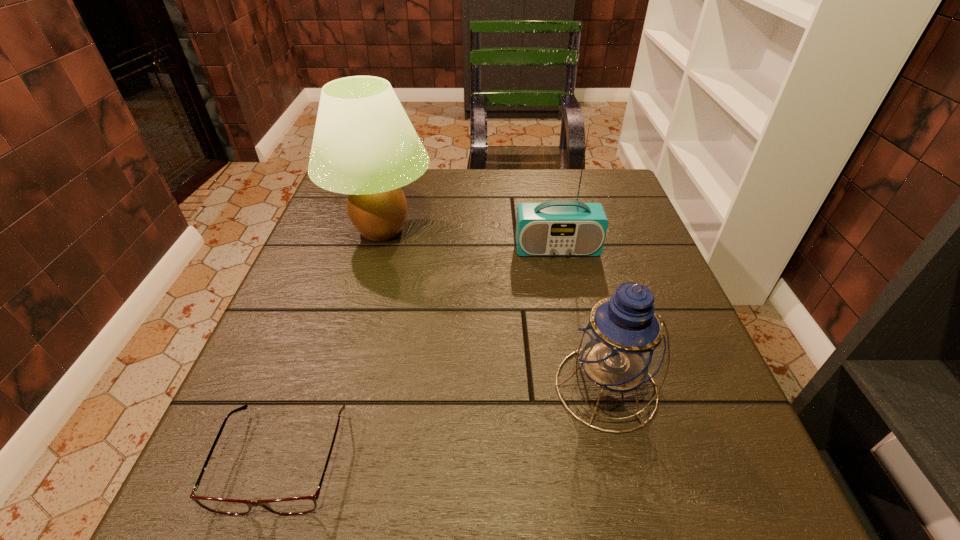
At what (x,y) coordinates should I click in order to perform the action: click on lampshade. Please return your answer as a coordinate pair (x, y). The image size is (960, 540). Looking at the image, I should click on [x=364, y=145].

Locate an element on the screen. the second tallest object is located at coordinates (559, 227).

I want to click on lantern, so click(x=620, y=344).

The width and height of the screenshot is (960, 540). In order to click on spectacles in this screenshot , I will do `click(305, 504)`.

I want to click on vacant space located on the shade of the lampshade, so click(x=548, y=230).

You are a GUI agent. You are given a task and a screenshot of the screen. Output one action in this format:
    pyautogui.click(x=<x>, y=<y>)
    Task: Click on the vacant position located on the front panel of the second tallest object
    The width and height of the screenshot is (960, 540).
    Given the screenshot: What is the action you would take?
    tap(567, 299)

The image size is (960, 540). Identify the location of vacant space located on the front-facing side of the lantern. (641, 529).

You are a GUI agent. You are given a task and a screenshot of the screen. Output one action in this format:
    pyautogui.click(x=<x>, y=<y>)
    Task: Click on the object located at the far edge
    The height and width of the screenshot is (540, 960).
    Given the screenshot: What is the action you would take?
    pyautogui.click(x=364, y=145)

This screenshot has width=960, height=540. What are the coordinates of `object positioned at the near edge` in the screenshot? It's located at (305, 504).

Find the location of `lampshade at the left edge`. lampshade at the left edge is located at coordinates (364, 145).